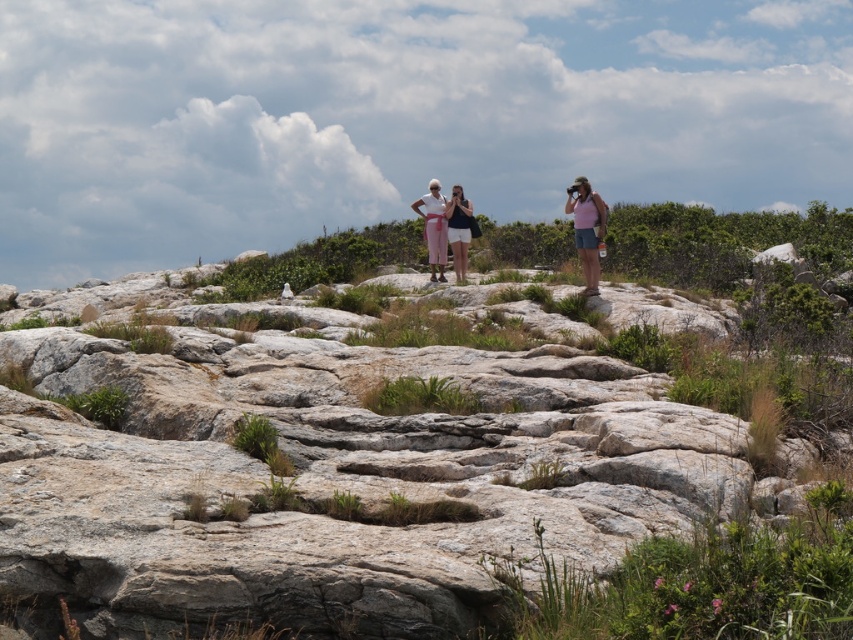
You are a photographer planning to take a picture of the pink fabric at center and the matte white shorts at center in the rocky landscape. Which object should you focus on first if you want to ensure both are in sharp focus?

You should focus on the pink fabric at center first because it is taller than the matte white shorts at center, so focusing on the taller object will help ensure both are in sharp focus.